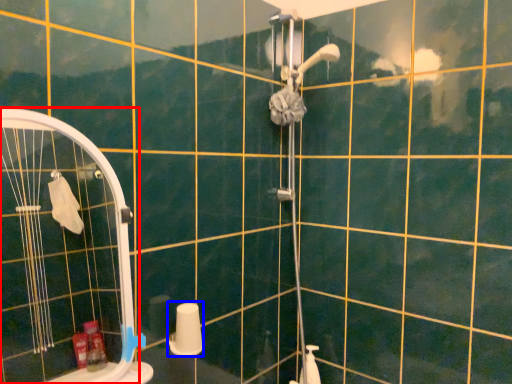
Question: Which object is closer to the camera taking this photo, screen door (highlighted by a red box) or toilet paper (highlighted by a blue box)?

Choices:
 (A) screen door
 (B) toilet paper

Answer: (A)